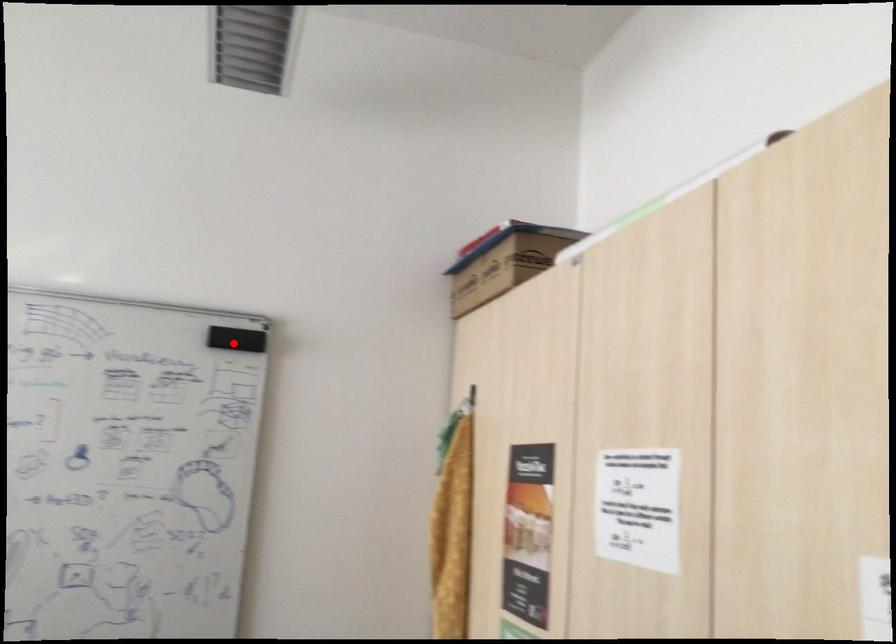
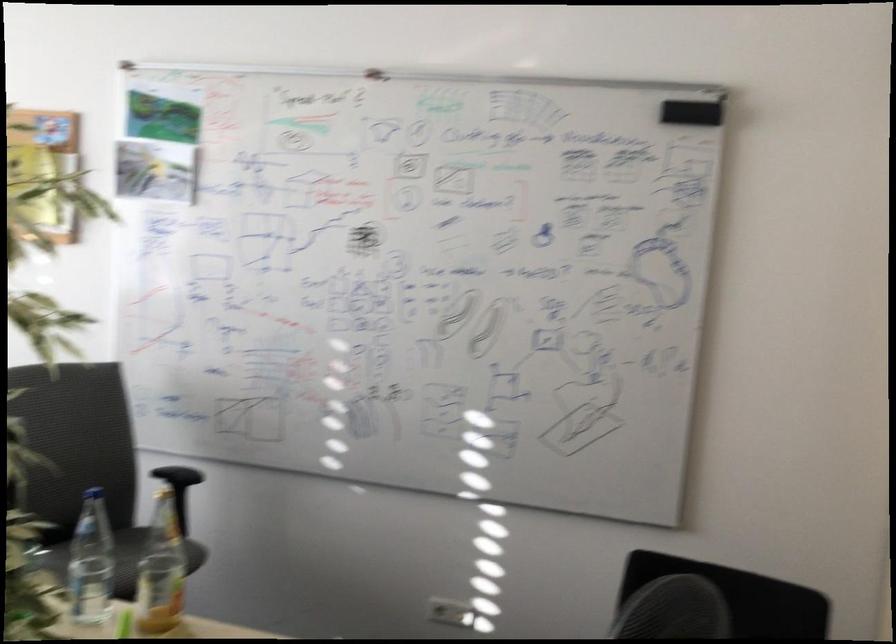
Where in the second image is the point corresponding to the highlighted location from the first image?

(692, 111)